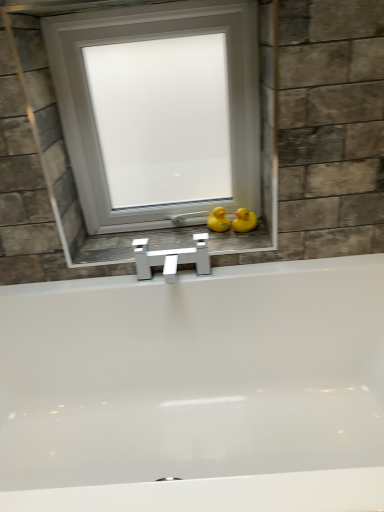
Question: Do you think yellow rubber duck at center, which is the 2th duck in right-to-left order, is within white glossy faucet at center, or outside of it?

Choices:
 (A) inside
 (B) outside

Answer: (B)

Question: Does point (213, 218) appear closer or farther from the camera than point (114, 247)?

Choices:
 (A) farther
 (B) closer

Answer: (A)

Question: Which of these objects is positioned closest to the yellow rubber duck at right, the first duck when ordered from right to left?

Choices:
 (A) white matte window at center
 (B) white glossy faucet at center
 (C) yellow rubber duck at center, which is the 2th duck in right-to-left order

Answer: (C)

Question: Based on their relative distances, which object is farther from the yellow rubber duck at center, which is the 2th duck in right-to-left order?

Choices:
 (A) yellow rubber duck at right, acting as the second duck starting from the left
 (B) white matte window at center
 (C) white glossy faucet at center

Answer: (B)